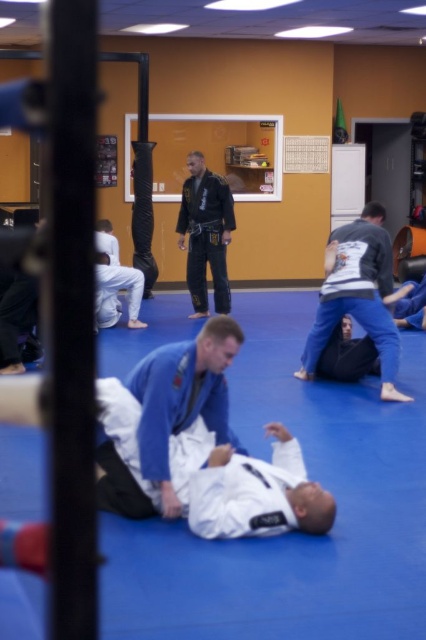
Question: Is blue fabric mat at center above black matte uniform at center?

Choices:
 (A) yes
 (B) no

Answer: (B)

Question: Is blue fabric mat at center smaller than black matte uniform at center?

Choices:
 (A) no
 (B) yes

Answer: (A)

Question: Among these objects, which one is nearest to the camera?

Choices:
 (A) blue fabric mat at center
 (B) black matte uniform at center

Answer: (A)

Question: Is blue fabric mat at center to the right of black matte uniform at center from the viewer's perspective?

Choices:
 (A) yes
 (B) no

Answer: (A)